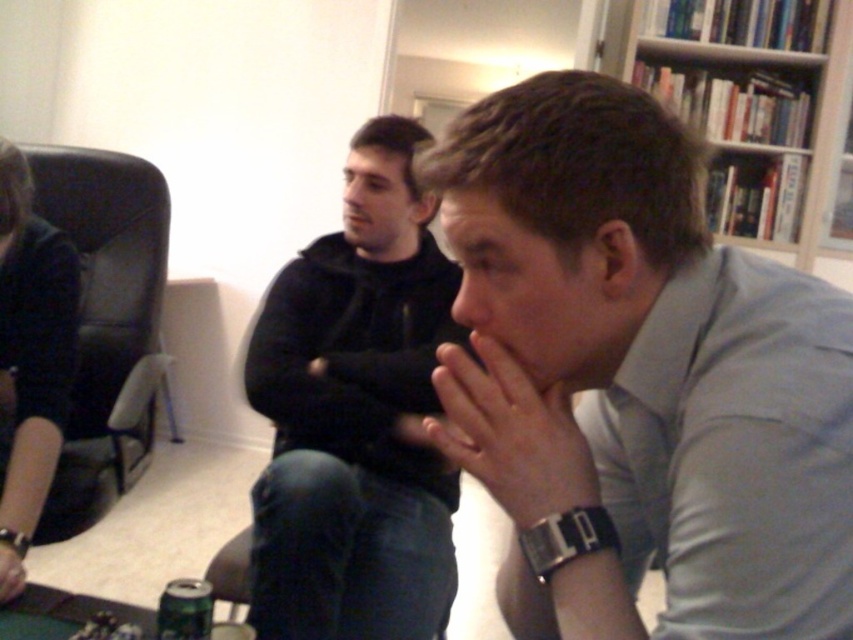
Question: Which of these objects is positioned closest to the gray smooth shirt at center?

Choices:
 (A) black hoodie at center
 (B) smooth skin hand at center

Answer: (B)

Question: Which of the following is the closest to the observer?

Choices:
 (A) metallic green can at lower left
 (B) white paper bookshelf at upper right

Answer: (A)

Question: Among these objects, which one is nearest to the camera?

Choices:
 (A) gray smooth shirt at center
 (B) white paper bookshelf at upper right

Answer: (A)

Question: Can you confirm if gray smooth shirt at center is positioned to the left of black leather armchair at left?

Choices:
 (A) no
 (B) yes

Answer: (A)

Question: Considering the relative positions of white paper bookshelf at upper right and black leather jacket at left in the image provided, where is white paper bookshelf at upper right located with respect to black leather jacket at left?

Choices:
 (A) above
 (B) below

Answer: (A)

Question: Is gray smooth shirt at center below black leather armchair at left?

Choices:
 (A) no
 (B) yes

Answer: (B)